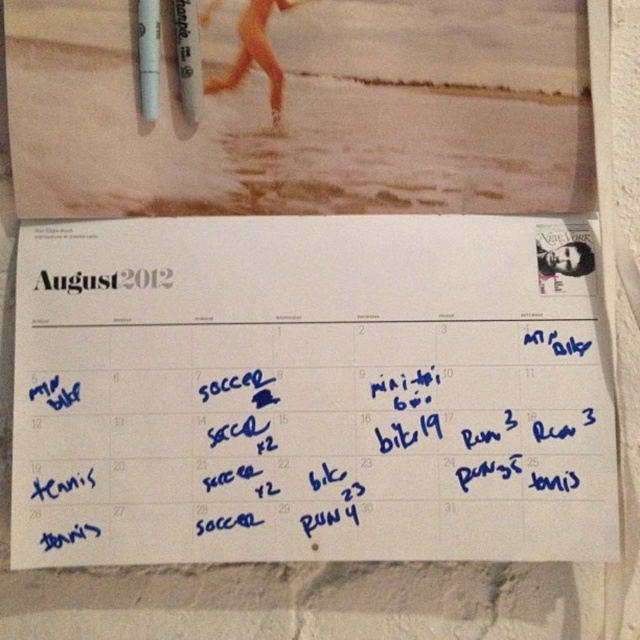
Question: Which of the following is the farthest from the observer?

Choices:
 (A) tap(224, 364)
 (B) tap(148, 122)

Answer: (A)

Question: Which point is closer to the camera?

Choices:
 (A) white paper at center
 (B) white matte pen at upper left

Answer: (A)

Question: Does white paper at center have a greater width compared to white matte pen at upper left?

Choices:
 (A) yes
 (B) no

Answer: (A)

Question: Is white paper at center above white matte pen at upper left?

Choices:
 (A) yes
 (B) no

Answer: (B)

Question: Which point is closer to the camera?

Choices:
 (A) (196, 225)
 (B) (148, 19)

Answer: (B)

Question: Is white paper at center to the right of white matte pen at upper left from the viewer's perspective?

Choices:
 (A) yes
 (B) no

Answer: (A)